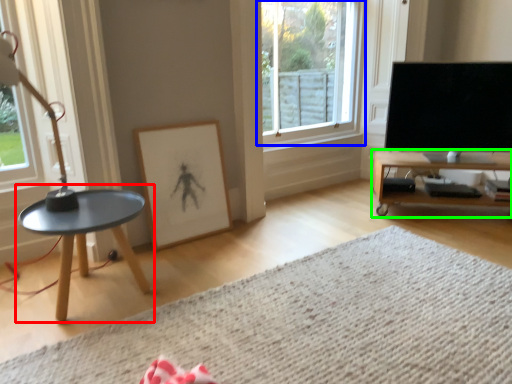
Question: Based on their relative distances, which object is farther from coffee table (highlighted by a red box)? Choose from window (highlighted by a blue box) and table (highlighted by a green box).

Choices:
 (A) window
 (B) table

Answer: (B)